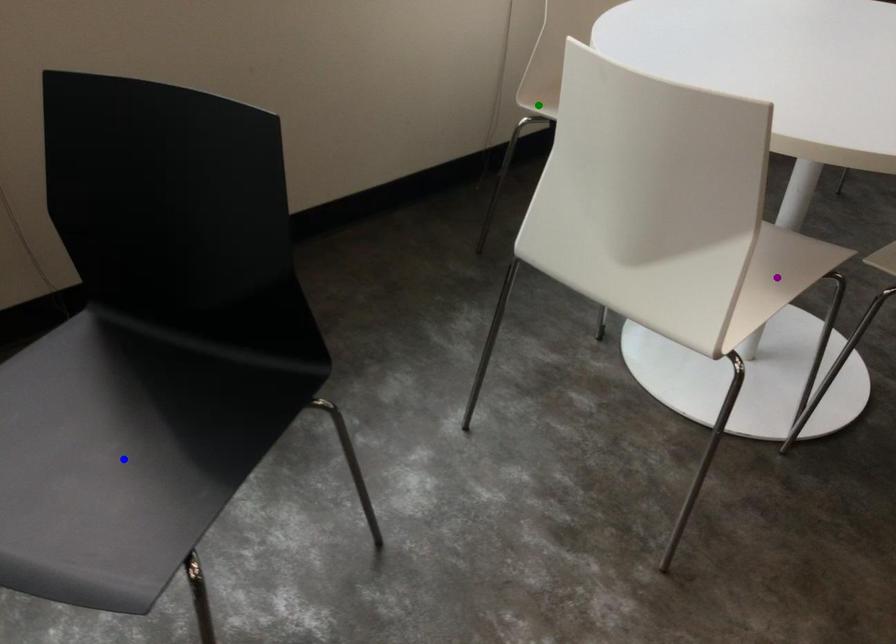
Order these from farthest to nearest:
blue point
green point
purple point

green point → purple point → blue point